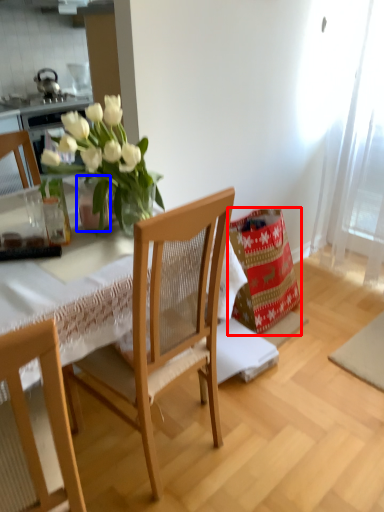
Question: Which of the following is the closest to the observer, material (highlighted by a red box) or vase (highlighted by a blue box)?

Choices:
 (A) material
 (B) vase

Answer: (B)